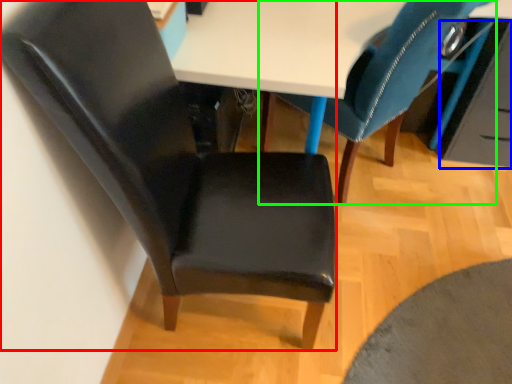
Question: Which is farther away from chair (highlighted by a red box)? drawer (highlighted by a blue box) or chair (highlighted by a green box)?

Choices:
 (A) drawer
 (B) chair

Answer: (A)